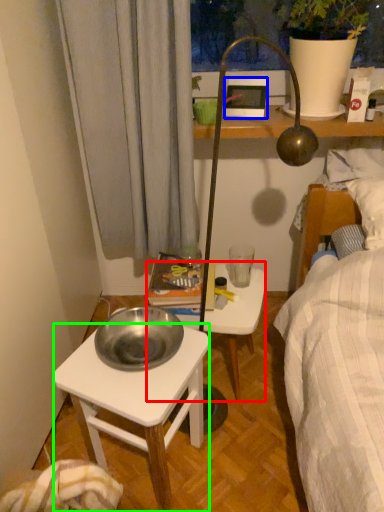
Question: Estimate the real-world distances between objects in this image. Which object is farther from stool (highlighted by a red box), picture frame (highlighted by a blue box) or desk (highlighted by a green box)?

Choices:
 (A) picture frame
 (B) desk

Answer: (A)